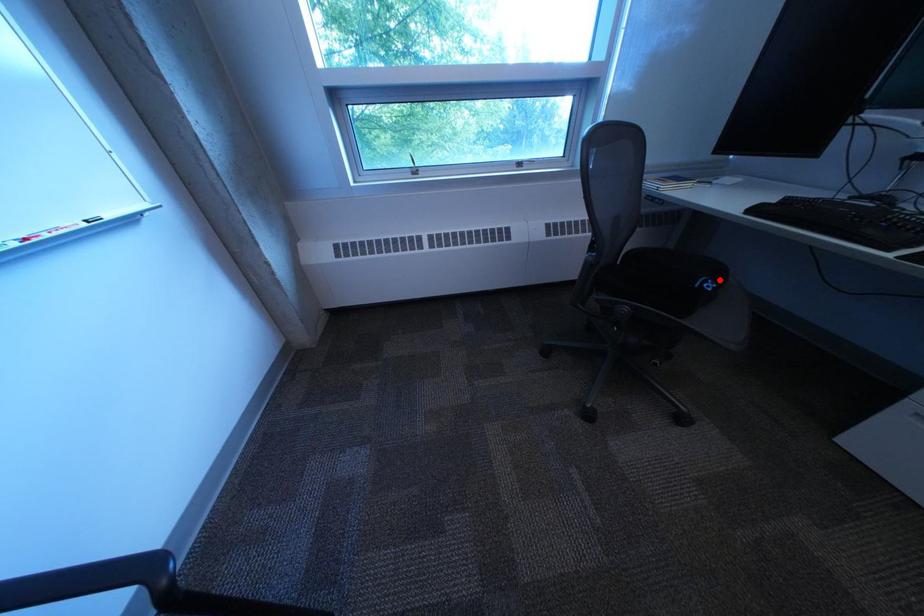
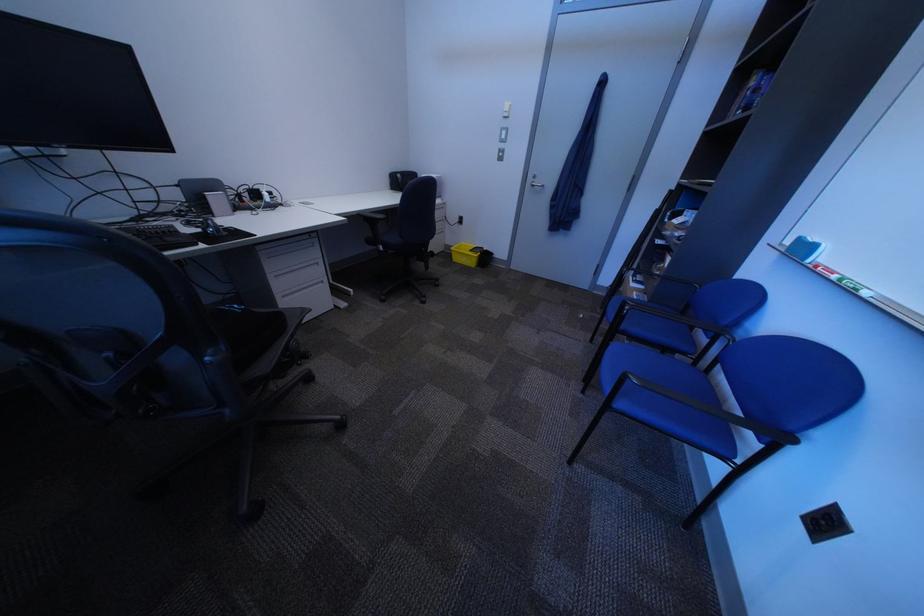
The point at the highlighted location is marked in the first image. Where is the corresponding point in the second image?

(238, 310)